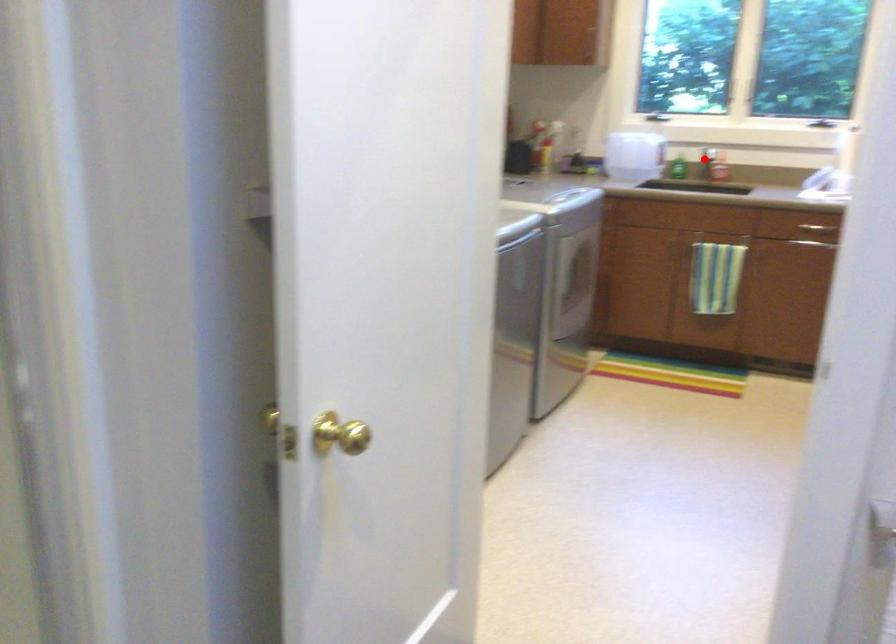
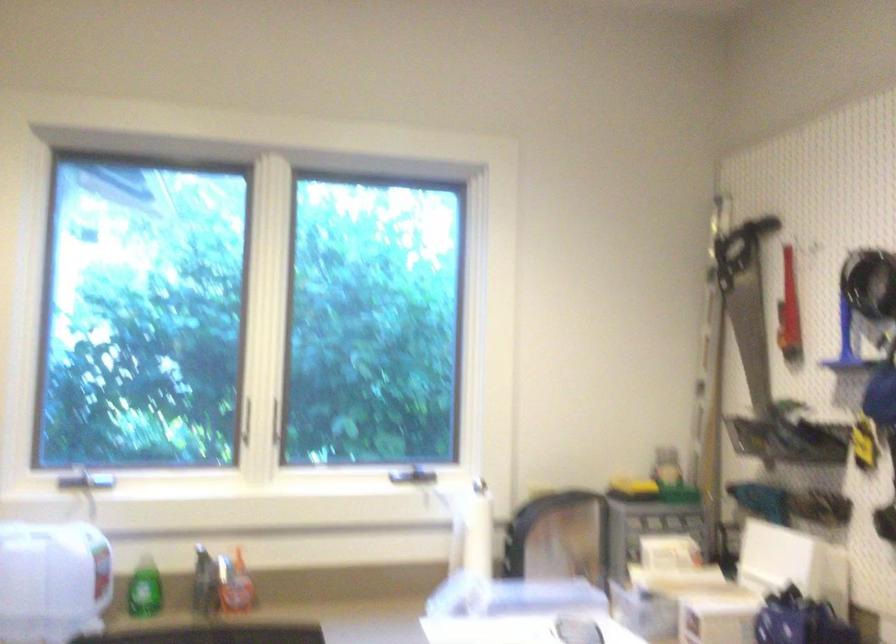
Question: I am providing you with two images of the same scene from different viewpoints. A red point is shown in image1. For the corresponding object point in image2, is it positioned nearer or farther from the camera?

Choices:
 (A) Nearer
 (B) Farther

Answer: (A)